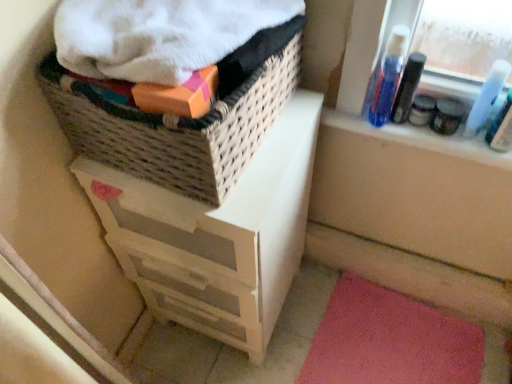
The height and width of the screenshot is (384, 512). I want to click on vacant area that lies between white painted wood chest of drawers at upper left and pink carpet at lower right, so click(292, 324).